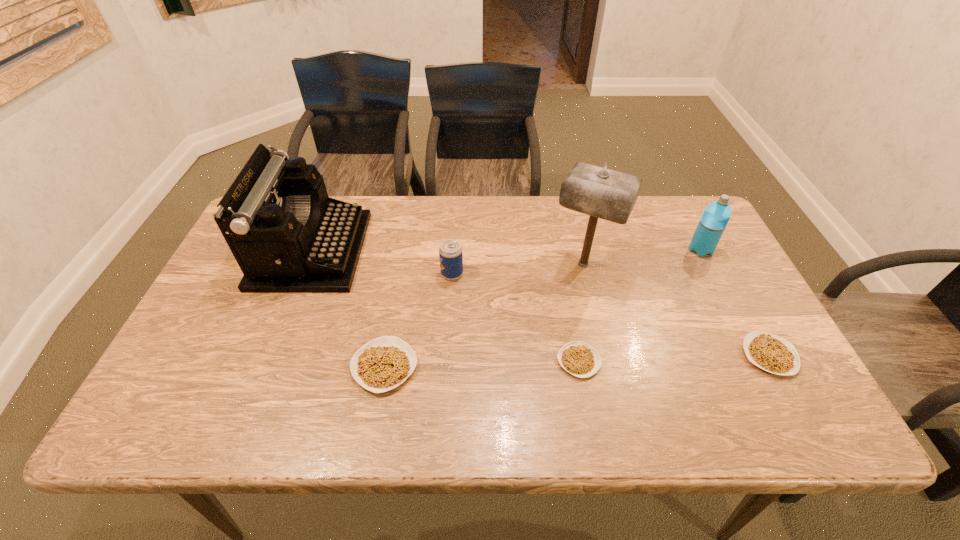
Given the evenly spaced legumes in the image, where should an extra legume be added on the left to preserve the spacing? Please point to a vacant space. Please provide its 2D coordinates. Your answer should be formatted as a tuple, i.e. [(x, y)], where the tuple contains the x and y coordinates of a point satisfying the conditions above.

[(186, 372)]